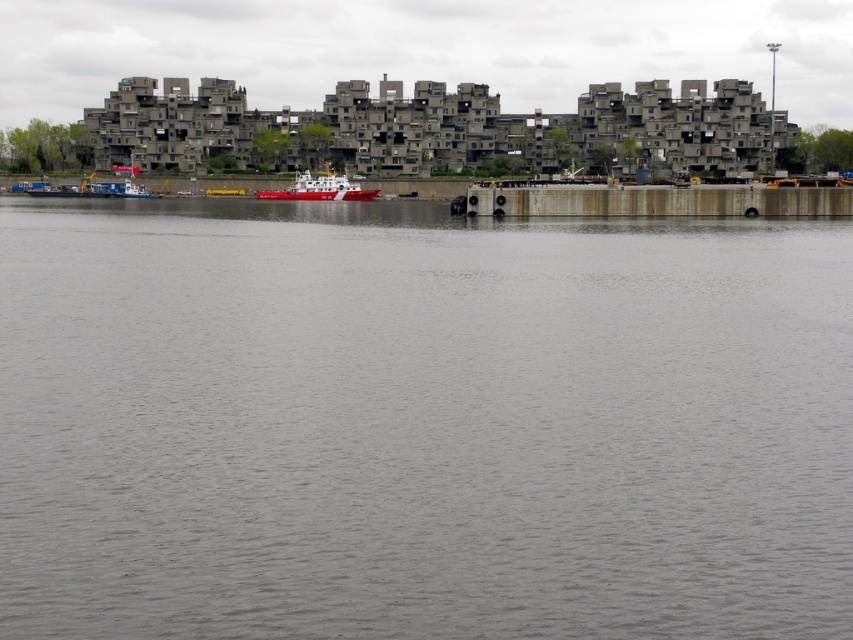
You are standing on the dock and see the gray water at center and the red glossy boat at center. Which object is positioned to the right of the other?

The gray water at center is to the right of the red glossy boat at center.

You are a photographer planning to capture the entire view of the gray water at center and the red glossy boat at center in one shot. Given that your camera has a fixed focal length and you can only adjust your position, which direction should you move to ensure both objects are fully visible in the frame?

To ensure both the gray water at center and the red glossy boat at center are fully visible, you should move backward since the gray water at center is wider than the red glossy boat at center, requiring a wider angle of view to capture both in one frame.

From the picture: You are standing at the edge of the scene and want to reach the gray water at center. Which direction should you move in to get there?

To reach the gray water at center, you should move towards the point located at coordinates 0.661 on the x axis and 0.494 on the y axis.